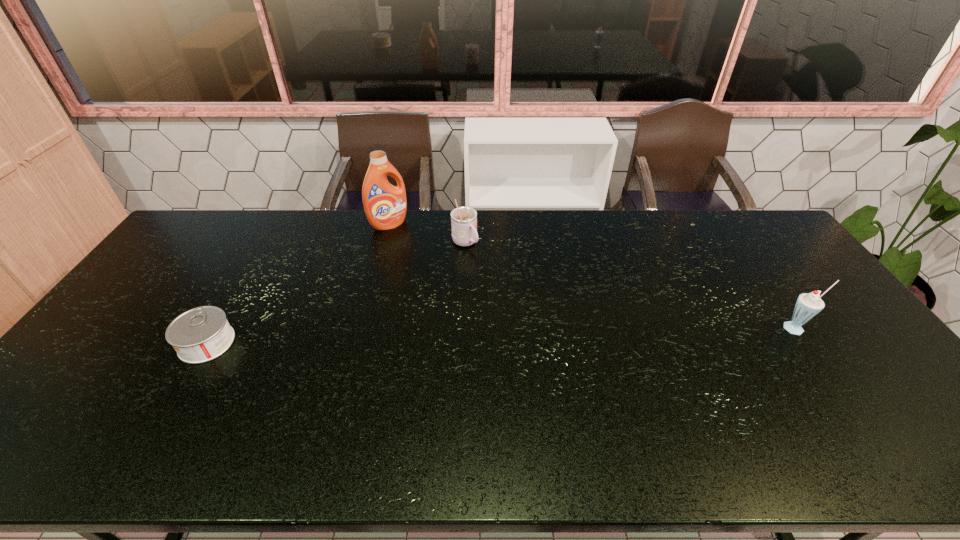
Find the location of `vacant space located 0.200m on the side with the handle of the second farthest object`. vacant space located 0.200m on the side with the handle of the second farthest object is located at coordinates (509, 285).

Where is `vacant space located 0.350m on the side with the handle of the second farthest object`? vacant space located 0.350m on the side with the handle of the second farthest object is located at coordinates (540, 313).

You are a GUI agent. You are given a task and a screenshot of the screen. Output one action in this format:
    pyautogui.click(x=<x>, y=<y>)
    Task: Click on the free space located on the front-facing side of the farthest object
    This screenshot has height=540, width=960.
    Given the screenshot: What is the action you would take?
    pyautogui.click(x=439, y=280)

Identify the location of free space located 0.330m on the front-facing side of the farthest object. (442, 284).

Where is `free location located on the front-facing side of the farthest object`? This screenshot has height=540, width=960. free location located on the front-facing side of the farthest object is located at coordinates (418, 255).

This screenshot has height=540, width=960. What are the coordinates of `cup located at the far edge` in the screenshot? It's located at (463, 219).

The width and height of the screenshot is (960, 540). I want to click on detergent located in the far edge section of the desktop, so click(385, 205).

Locate an element on the screen. The height and width of the screenshot is (540, 960). object at the right edge is located at coordinates (808, 305).

The height and width of the screenshot is (540, 960). Find the location of `blank space at the far edge of the desktop`. blank space at the far edge of the desktop is located at coordinates (556, 231).

At what (x,y) coordinates should I click in order to perform the action: click on vacant space at the near edge of the desktop. Please return your answer as a coordinate pair (x, y). The height and width of the screenshot is (540, 960). Looking at the image, I should click on (232, 395).